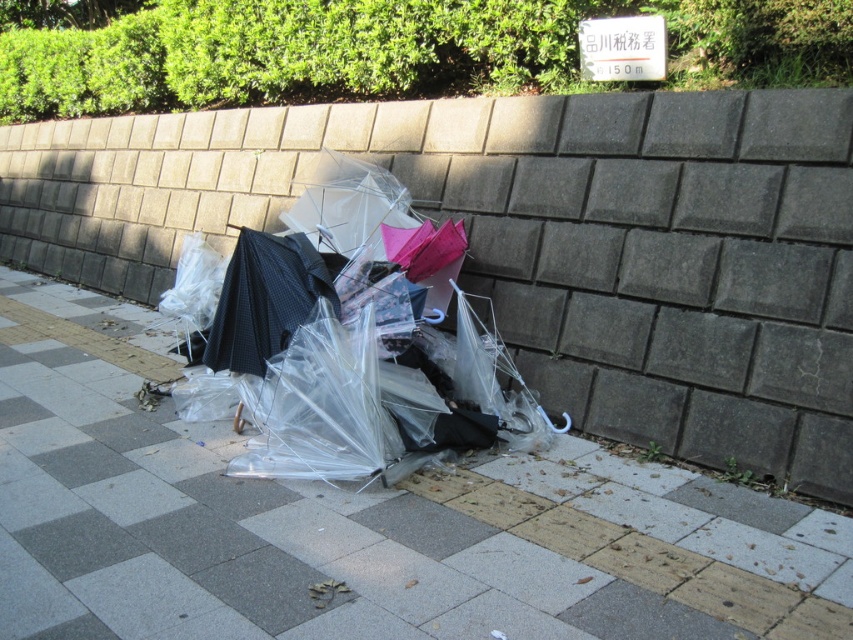
Is point (503, 417) closer to viewer compared to point (328, 268)?

Yes, point (503, 417) is in front of point (328, 268).

Between point (341, 156) and point (264, 291), which one is positioned behind?

Positioned behind is point (341, 156).

This screenshot has width=853, height=640. I want to click on transparent plastic umbrellas at center, so [x=367, y=355].

Who is shorter, transparent plastic umbrellas at lower center or black textured umbrella at center?

transparent plastic umbrellas at lower center

Does transparent plastic umbrellas at lower center have a greater height compared to black textured umbrella at center?

No, transparent plastic umbrellas at lower center is not taller than black textured umbrella at center.

Does point (254, 157) come farther from viewer compared to point (264, 346)?

That is True.

Find the location of a particular element. The width and height of the screenshot is (853, 640). transparent plastic umbrellas at lower center is located at coordinates (535, 241).

Can you confirm if transparent plastic umbrella at center is smaller than transparent plastic umbrellas at center?

No.

Locate an element on the screen. This screenshot has height=640, width=853. transparent plastic umbrella at center is located at coordinates (357, 524).